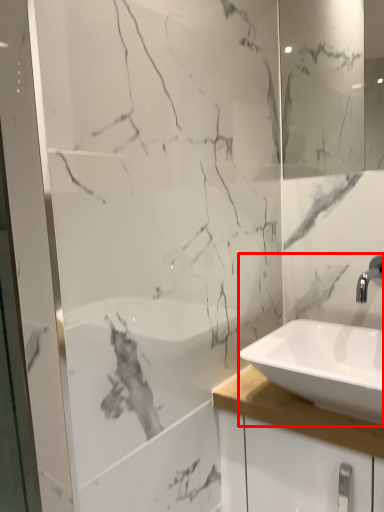
Question: From the image's perspective, what is the correct spatial positioning of sink (annotated by the red box) in reference to mirror?

Choices:
 (A) above
 (B) below

Answer: (B)